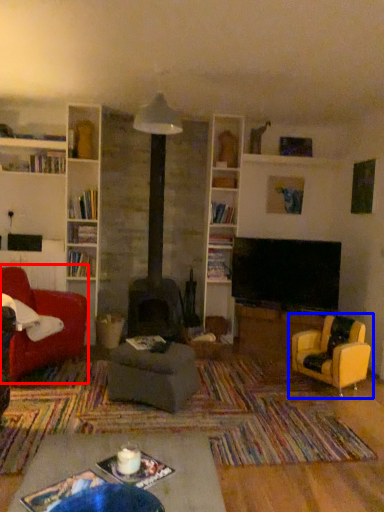
Question: Which of the following is the closest to the observer, chair (highlighted by a red box) or chair (highlighted by a blue box)?

Choices:
 (A) chair
 (B) chair

Answer: (A)